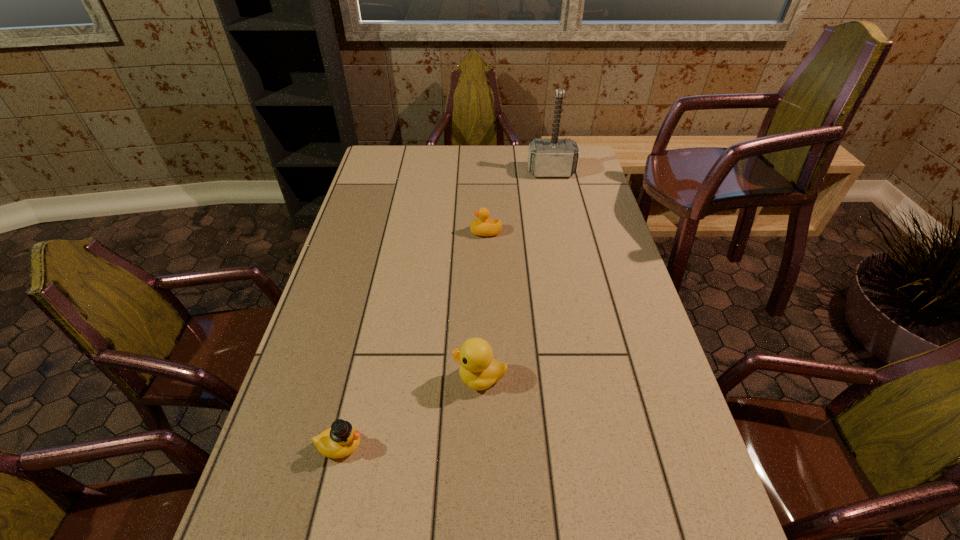
At what (x,y) coordinates should I click in order to perform the action: click on free point that satisfies the following two spatial constraints: 1. for striking with the head of the hammer; 2. on the face of the third farthest object. Please return your answer as a coordinate pair (x, y). This screenshot has height=540, width=960. Looking at the image, I should click on (596, 377).